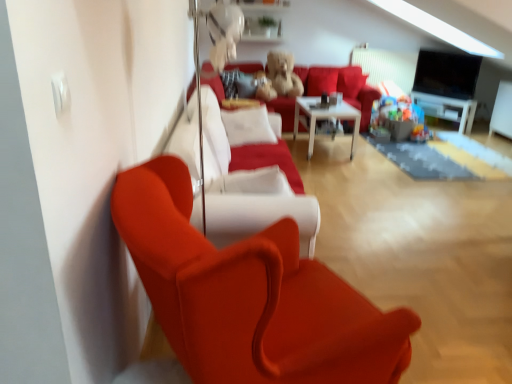
Question: Is satin red armchair at left wider or thinner than white glossy table at center?

Choices:
 (A) wide
 (B) thin

Answer: (B)

Question: From a real-world perspective, is satin red armchair at left positioned above or below white glossy table at center?

Choices:
 (A) below
 (B) above

Answer: (B)

Question: Estimate the real-world distances between objects in this image. Which object is closer to the white glossy entertainment center at right?

Choices:
 (A) satin red armchair at left
 (B) white soft cushion at center
 (C) velvet red couch at center
 (D) white glossy table at center
 (E) fuzzy brown teddy bear at center

Answer: (C)

Question: Based on their relative distances, which object is nearer to the white soft cushion at center?

Choices:
 (A) fuzzy brown teddy bear at center
 (B) satin red couch at center
 (C) white glossy entertainment center at right
 (D) white glossy table at center
 (E) velvet red couch at center

Answer: (B)